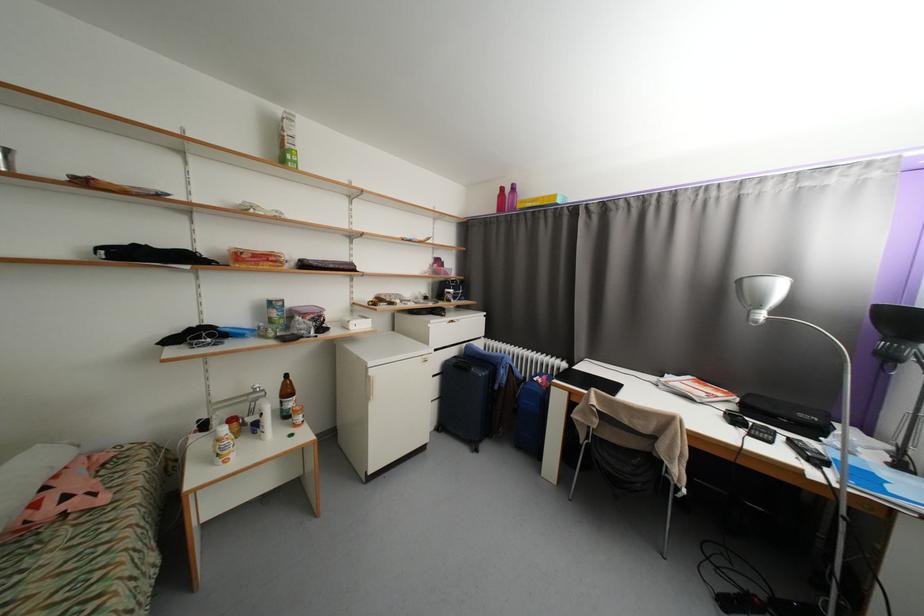
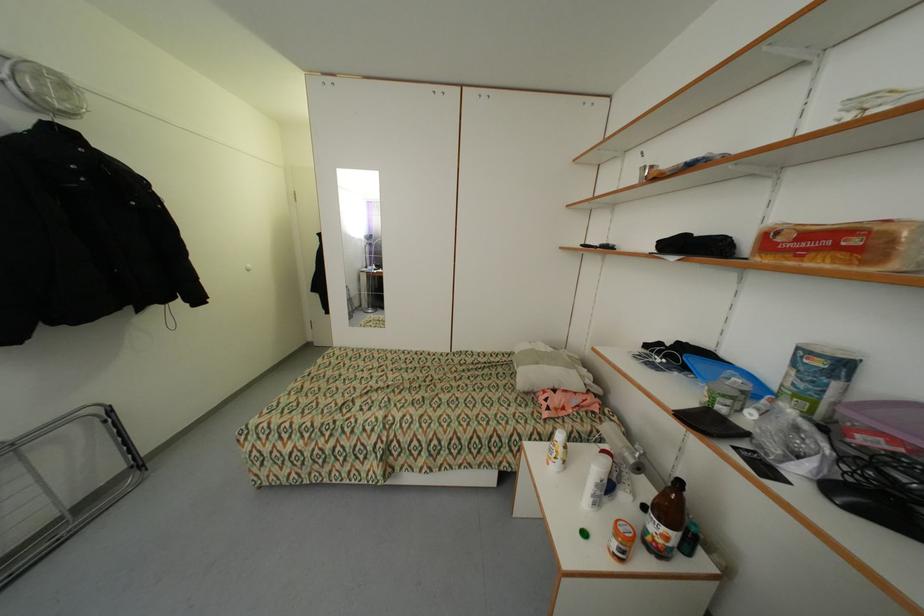
Find the pixel in the second image that matches point 320,314 in the first image.

(900, 440)